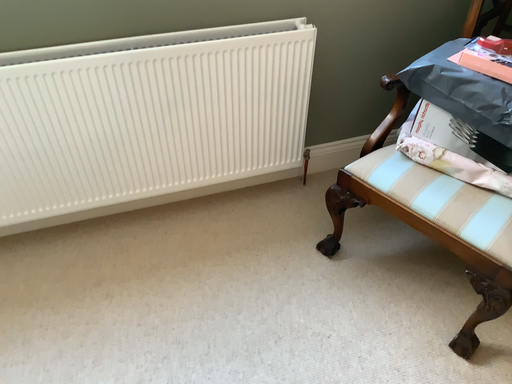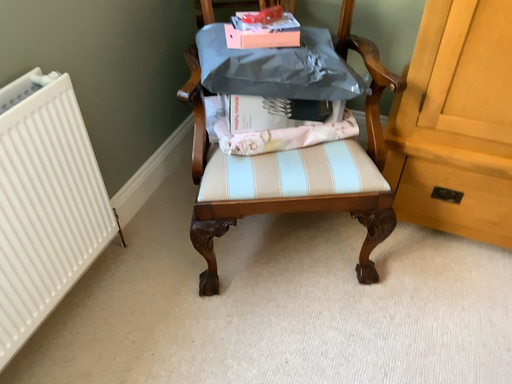
Question: Which way did the camera rotate in the video?

Choices:
 (A) rotated right
 (B) rotated left

Answer: (A)